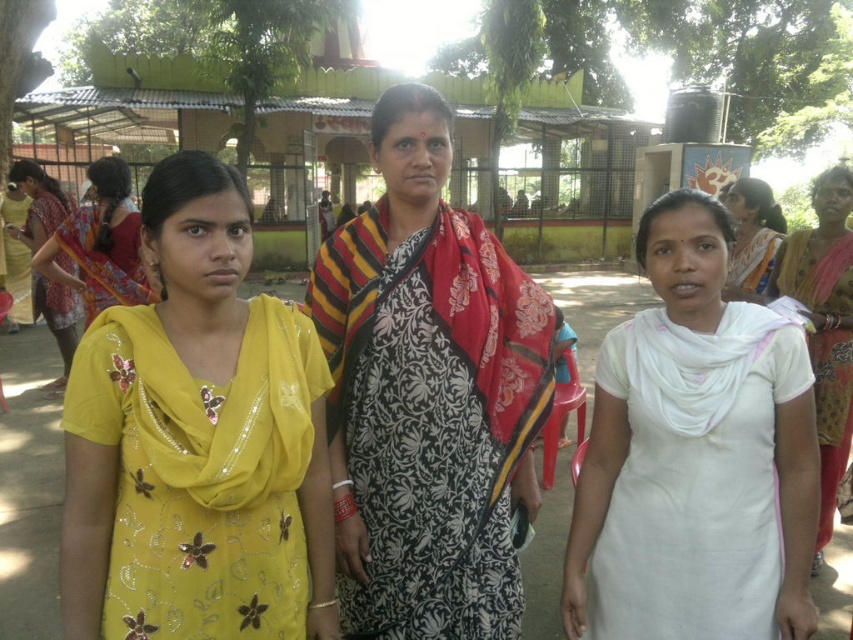
Does point (703, 464) come closer to viewer compared to point (154, 285)?

That is True.

Between point (772, 339) and point (119, 262), which one is positioned in front?

Point (772, 339) is more forward.

Find the location of a particular element. The width and height of the screenshot is (853, 640). white cotton dress at center is located at coordinates (695, 456).

Is point (781, 273) closer to camera compared to point (54, 180)?

Yes.

Between point (839, 358) and point (25, 172), which one is positioned behind?

The point (25, 172) is behind.

Describe the element at coordinates (824, 324) in the screenshot. I see `brown textured saree at right` at that location.

In order to click on brown textured saree at right in this screenshot , I will do `click(824, 324)`.

Measure the distance between black printed saree at center and matte pink saree at upper right.

black printed saree at center is 1.91 meters away from matte pink saree at upper right.

Between point (459, 524) and point (763, 241), which one is positioned in front?

Point (459, 524)

The width and height of the screenshot is (853, 640). I want to click on black printed saree at center, so click(427, 394).